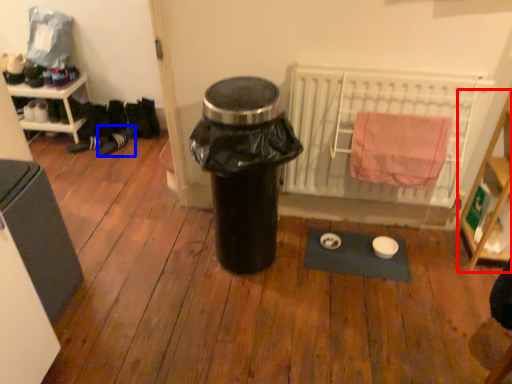
Question: Among these objects, which one is farthest to the camera, shelf (highlighted by a red box) or shoe (highlighted by a blue box)?

Choices:
 (A) shelf
 (B) shoe

Answer: (B)